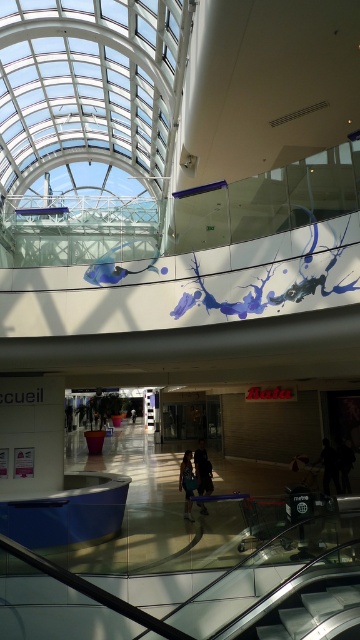
Question: Is dark blue jeans at center positioned behind blue denim jeans at center?

Choices:
 (A) no
 (B) yes

Answer: (A)

Question: Among these points, which one is farthest from the camera?

Choices:
 (A) (190, 497)
 (B) (206, 484)

Answer: (B)

Question: Among these objects, which one is nearest to the camera?

Choices:
 (A) dark blue jeans at center
 (B) blue denim jeans at center

Answer: (A)

Question: Can you confirm if dark blue jeans at center is positioned to the right of blue denim jeans at center?

Choices:
 (A) yes
 (B) no

Answer: (A)

Question: Which of the following is the closest to the observer?

Choices:
 (A) dark blue jeans at center
 (B) blue denim jeans at center

Answer: (A)

Question: Considering the relative positions of dark blue jeans at center and blue denim jeans at center in the image provided, where is dark blue jeans at center located with respect to blue denim jeans at center?

Choices:
 (A) right
 (B) left

Answer: (A)